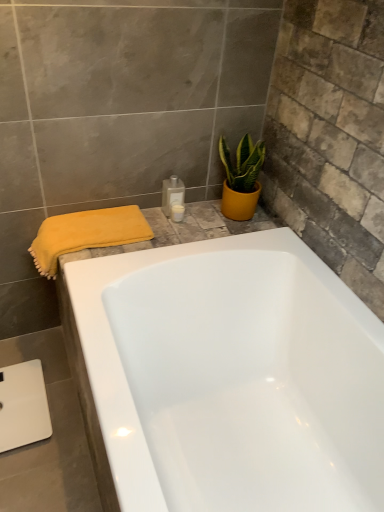
Image resolution: width=384 pixels, height=512 pixels. Find the location of `free space in front of white glossy bottle at upper center, acting as the 2th toiletry starting from the top`. free space in front of white glossy bottle at upper center, acting as the 2th toiletry starting from the top is located at coordinates (163, 237).